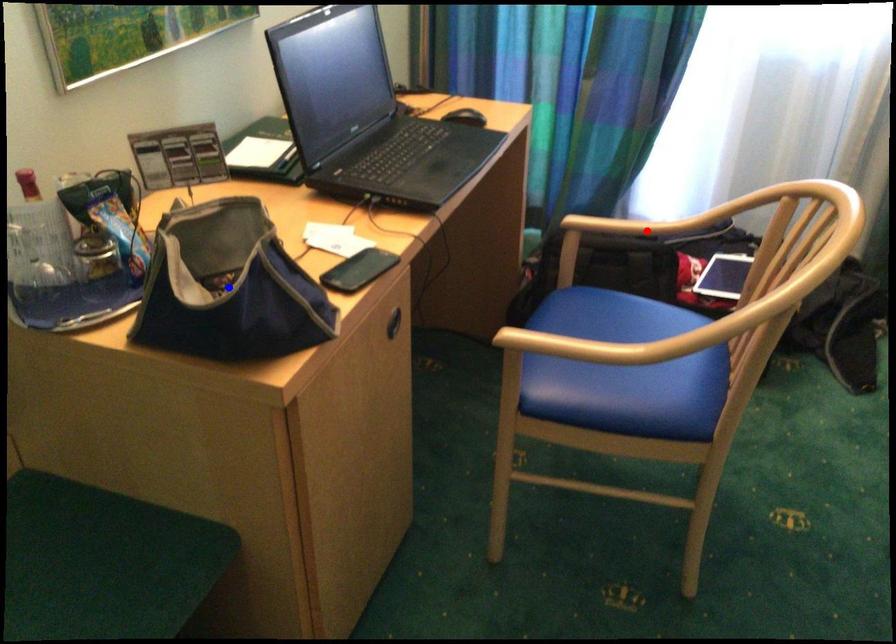
Question: In the image, two points are highlighted. Which point is nearer to the camera? Reply with the corresponding letter.

Choices:
 (A) blue point
 (B) red point

Answer: (A)